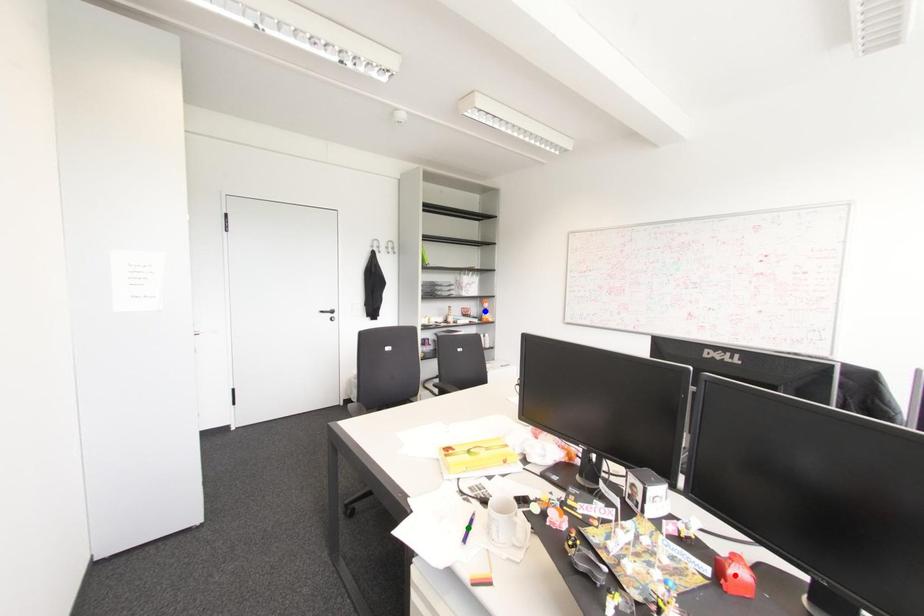
Order these from nearest to farthest:
green point, blue point, red point

1. blue point
2. green point
3. red point